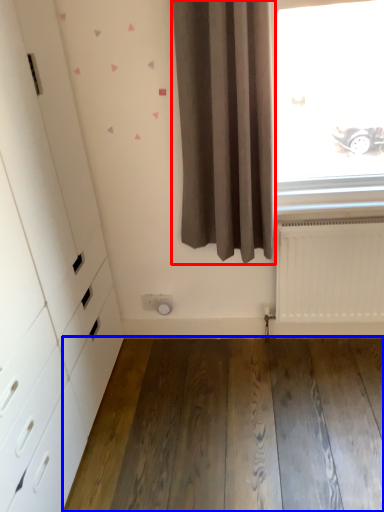
Question: Which object appears closest to the camera in this image, curtain (highlighted by a red box) or hardwood (highlighted by a blue box)?

Choices:
 (A) curtain
 (B) hardwood

Answer: (A)